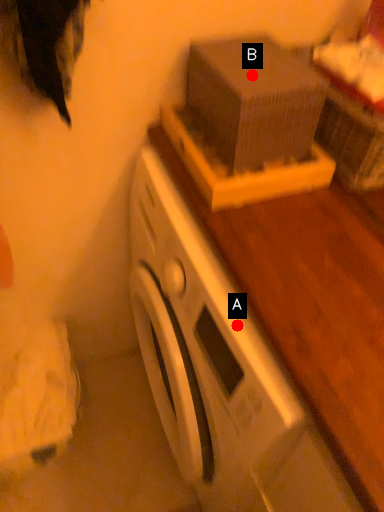
Question: Two points are circled on the image, labeled by A and B beside each circle. Which point appears farthest from the camera in this image?

Choices:
 (A) A is further
 (B) B is further

Answer: (B)